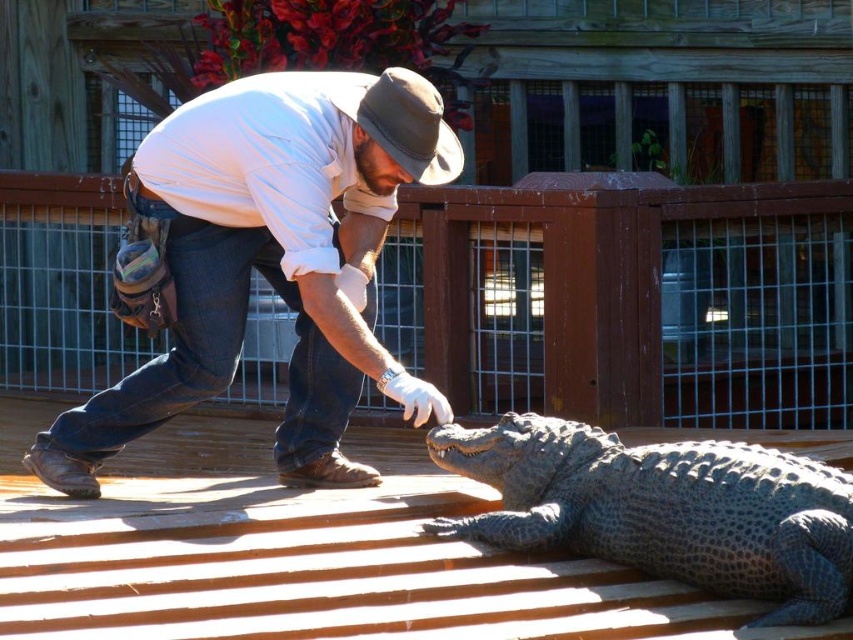
Question: Among these objects, which one is farthest from the camera?

Choices:
 (A) matte white shirt at center
 (B) gray scaly crocodile at lower right
 (C) brown wooden deck at center

Answer: (A)

Question: Does brown wooden deck at center appear over matte white shirt at center?

Choices:
 (A) no
 (B) yes

Answer: (A)

Question: Is matte white shirt at center smaller than gray scaly crocodile at lower right?

Choices:
 (A) yes
 (B) no

Answer: (A)

Question: Which is farther from the matte white shirt at center?

Choices:
 (A) gray scaly crocodile at lower right
 (B) brown wooden deck at center

Answer: (B)

Question: Which point is farther to the camera?

Choices:
 (A) gray scaly crocodile at lower right
 (B) matte white shirt at center

Answer: (B)

Question: Observing the image, what is the correct spatial positioning of brown wooden deck at center in reference to matte white shirt at center?

Choices:
 (A) right
 (B) left

Answer: (A)